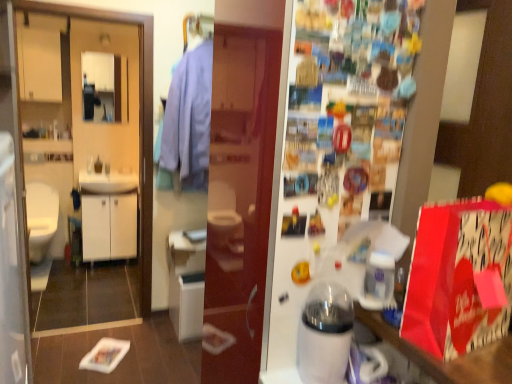
At what (x,y) coordinates should I click in order to perform the action: click on white glossy humidifier at center, the 1th appliance in the left-to-right sequence. Please return your answer as a coordinate pair (x, y). The height and width of the screenshot is (384, 512). Looking at the image, I should click on (325, 334).

Describe the element at coordinates (379, 281) in the screenshot. Image resolution: width=512 pixels, height=384 pixels. I see `white plastic water dispenser at center, the first appliance when ordered from right to left` at that location.

In order to face white plastic water dispenser at center, the first appliance when ordered from right to left, should I rotate leftwards or rightwards?

Rotate right and turn 16.332 degrees.

Describe the element at coordinates (109, 227) in the screenshot. I see `white matte cabinet at left, which is counted as the 2th cabinetry, starting from the top` at that location.

Image resolution: width=512 pixels, height=384 pixels. Describe the element at coordinates (41, 218) in the screenshot. I see `white glossy toilet at left` at that location.

This screenshot has width=512, height=384. Describe the element at coordinates (106, 181) in the screenshot. I see `white glossy sink at left` at that location.

Where is `white glossy humidifier at center, which ranks as the second appliance in right-to-left order`? white glossy humidifier at center, which ranks as the second appliance in right-to-left order is located at coordinates (325, 334).

Is light blue fabric shirt at center next to white matte cabinet at left, placed as the first cabinetry when sorted from bottom to top, and touching it?

light blue fabric shirt at center is not next to white matte cabinet at left, placed as the first cabinetry when sorted from bottom to top, and they're not touching.

From the image's perspective, is light blue fabric shirt at center below white matte cabinet at left, the second cabinetry positioned from the left?

No.

Consider the image. Does light blue fabric shirt at center come behind white matte cabinet at left, which ranks as the first cabinetry in right-to-left order?

That is False.

Is light blue fabric shirt at center aimed at white matte cabinet at left, the second cabinetry positioned from the left?

No, light blue fabric shirt at center is not facing towards white matte cabinet at left, the second cabinetry positioned from the left.

Does point (326, 93) appear closer or farther from the camera than point (323, 322)?

Point (326, 93) is positioned closer to the camera compared to point (323, 322).

Would you say white glossy fridge at upper center contains white glossy humidifier at center, the 1th appliance in the left-to-right sequence?

Definitely not — white glossy humidifier at center, the 1th appliance in the left-to-right sequence, is not inside white glossy fridge at upper center.

Is white glossy fridge at upper center smaller than white glossy humidifier at center, which ranks as the second appliance in right-to-left order?

Incorrect, white glossy fridge at upper center is not smaller in size than white glossy humidifier at center, which ranks as the second appliance in right-to-left order.

Considering the sizes of white glossy fridge at upper center and white glossy humidifier at center, which ranks as the second appliance in right-to-left order, in the image, is white glossy fridge at upper center taller or shorter than white glossy humidifier at center, which ranks as the second appliance in right-to-left order,?

In the image, white glossy fridge at upper center appears to be taller than white glossy humidifier at center, which ranks as the second appliance in right-to-left order.

Find the location of a particular element. The image size is (512, 384). the 1st cabinetry in front when counting from the matte white medicine cabinet at upper left is located at coordinates (109, 227).

Is matte white medicine cabinet at upper left situated inside white matte cabinet at left, placed as the first cabinetry when sorted from bottom to top, or outside?

The correct answer is: outside.

Considering the sizes of matte white medicine cabinet at upper left and white matte cabinet at left, placed as the first cabinetry when sorted from bottom to top, in the image, is matte white medicine cabinet at upper left taller or shorter than white matte cabinet at left, placed as the first cabinetry when sorted from bottom to top,?

In the image, matte white medicine cabinet at upper left appears to be shorter than white matte cabinet at left, placed as the first cabinetry when sorted from bottom to top.

Is white glossy toilet at left not inside white plastic water dispenser at center, the first appliance when ordered from right to left?

white glossy toilet at left is positioned outside white plastic water dispenser at center, the first appliance when ordered from right to left.

Locate an element on the screen. Image resolution: width=512 pixels, height=384 pixels. appliance located above the white glossy toilet at left (from the image's perspective) is located at coordinates (379, 281).

Is white glossy toilet at left bigger or smaller than white plastic water dispenser at center, the second appliance in the left-to-right sequence?

Clearly, white glossy toilet at left is larger in size than white plastic water dispenser at center, the second appliance in the left-to-right sequence.

Is white glossy toilet at left taller or shorter than white plastic water dispenser at center, the second appliance in the left-to-right sequence?

Considering their sizes, white glossy toilet at left has more height than white plastic water dispenser at center, the second appliance in the left-to-right sequence.

Is white plastic water dispenser at center, the second appliance in the left-to-right sequence, outside of matte white medicine cabinet at upper left?

That's correct, white plastic water dispenser at center, the second appliance in the left-to-right sequence, is outside of matte white medicine cabinet at upper left.

Is white plastic water dispenser at center, the second appliance in the left-to-right sequence, wider or thinner than matte white medicine cabinet at upper left?

In the image, white plastic water dispenser at center, the second appliance in the left-to-right sequence, appears to be wider than matte white medicine cabinet at upper left.

Considering the relative positions of white plastic water dispenser at center, the second appliance in the left-to-right sequence, and matte white medicine cabinet at upper left in the image provided, is white plastic water dispenser at center, the second appliance in the left-to-right sequence, to the left or to the right of matte white medicine cabinet at upper left?

white plastic water dispenser at center, the second appliance in the left-to-right sequence, is to the right of matte white medicine cabinet at upper left.

Considering the sizes of objects white plastic water dispenser at center, the first appliance when ordered from right to left, and matte white medicine cabinet at upper left in the image provided, who is smaller, white plastic water dispenser at center, the first appliance when ordered from right to left, or matte white medicine cabinet at upper left?

white plastic water dispenser at center, the first appliance when ordered from right to left.

Which is correct: white glossy toilet at left is inside light blue fabric shirt at center, or outside of it?

white glossy toilet at left lies outside light blue fabric shirt at center.

Considering the positions of points (42, 221) and (189, 117), is point (42, 221) farther from camera compared to point (189, 117)?

Yes, point (42, 221) is farther from viewer.

Between white glossy toilet at left and light blue fabric shirt at center, which one is positioned in front?

light blue fabric shirt at center is more forward.

At what (x,y) coordinates should I click in order to perform the action: click on sit below the light blue fabric shirt at center (from a real-world perspective). Please return your answer as a coordinate pair (x, y). This screenshot has width=512, height=384. Looking at the image, I should click on (41, 218).

Is white matte cabinet at left, which ranks as the first cabinetry in right-to-left order, positioned before white glossy sink at left?

No, it is not.

Is white matte cabinet at left, which is counted as the 2th cabinetry, starting from the top, not close to white glossy sink at left?

No, white matte cabinet at left, which is counted as the 2th cabinetry, starting from the top, is in close proximity to white glossy sink at left.

Which is closer, (114, 195) or (80, 171)?

Positioned in front is point (114, 195).

From a real-world perspective, is white matte cabinet at left, the second cabinetry positioned from the left, physically above white glossy sink at left?

No.

At what (x,y) coordinates should I click in order to perform the action: click on clothing above the white matte cabinet at left, which ranks as the first cabinetry in right-to-left order (from the image's perspective). Please return your answer as a coordinate pair (x, y). Image resolution: width=512 pixels, height=384 pixels. Looking at the image, I should click on (188, 122).

You are a GUI agent. You are given a task and a screenshot of the screen. Output one action in this format:
    pyautogui.click(x=<x>, y=<y>)
    Task: Click on the appliance that appears on the left of white glossy fridge at upper center
    This screenshot has width=512, height=384.
    Given the screenshot: What is the action you would take?
    pyautogui.click(x=325, y=334)

Which object lies further to the anchor point light blue fabric shirt at center, matte white cabinet at upper left, which is counted as the first cabinetry, starting from the top, or white glossy toilet at left?

white glossy toilet at left is further to light blue fabric shirt at center.

Which object lies nearer to the anchor point white glossy fridge at upper center, white matte cabinet at left, the second cabinetry positioned from the left, or white glossy sink at left?

The object closer to white glossy fridge at upper center is white matte cabinet at left, the second cabinetry positioned from the left.

Considering their positions, is white plastic water dispenser at center, the first appliance when ordered from right to left, positioned closer to white glossy humidifier at center, the 1th appliance in the left-to-right sequence, than white glossy toilet at left?

Among the two, white plastic water dispenser at center, the first appliance when ordered from right to left, is located nearer to white glossy humidifier at center, the 1th appliance in the left-to-right sequence.

Which object lies further to the anchor point matte white cabinet at upper left, which is counted as the first cabinetry, starting from the top, matte white medicine cabinet at upper left or white glossy fridge at upper center?

white glossy fridge at upper center.

Looking at the image, which one is located closer to matte white medicine cabinet at upper left, white plastic water dispenser at center, the second appliance in the left-to-right sequence, or light blue fabric shirt at center?

light blue fabric shirt at center.

Estimate the real-world distances between objects in this image. Which object is closer to transparent plastic screen door at left, matte white medicine cabinet at upper left or matte white cabinet at upper left, the 2th cabinetry from the bottom?

Among the two, matte white cabinet at upper left, the 2th cabinetry from the bottom, is located nearer to transparent plastic screen door at left.

Considering their positions, is light blue fabric shirt at center positioned closer to white matte cabinet at left, which is counted as the 2th cabinetry, starting from the top, than white glossy toilet at left?

white glossy toilet at left lies closer to white matte cabinet at left, which is counted as the 2th cabinetry, starting from the top, than the other object.

Based on their spatial positions, is white plastic water dispenser at center, the second appliance in the left-to-right sequence, or matte white medicine cabinet at upper left further from white glossy toilet at left?

The object further to white glossy toilet at left is white plastic water dispenser at center, the second appliance in the left-to-right sequence.

This screenshot has width=512, height=384. Identify the location of clothing between transparent plastic screen door at left and white glossy sink at left from front to back. (188, 122).

This screenshot has width=512, height=384. Find the location of `screen door between white glossy fridge at upper center and white glossy toilet at left from front to back`. screen door between white glossy fridge at upper center and white glossy toilet at left from front to back is located at coordinates (11, 222).

The width and height of the screenshot is (512, 384). In order to click on clothing between transparent plastic screen door at left and white glossy humidifier at center, which ranks as the second appliance in right-to-left order, from left to right in this screenshot , I will do `click(188, 122)`.

At what (x,y) coordinates should I click in order to perform the action: click on screen door between white glossy fridge at upper center and matte white medicine cabinet at upper left from front to back. Please return your answer as a coordinate pair (x, y). This screenshot has height=384, width=512. Looking at the image, I should click on (11, 222).